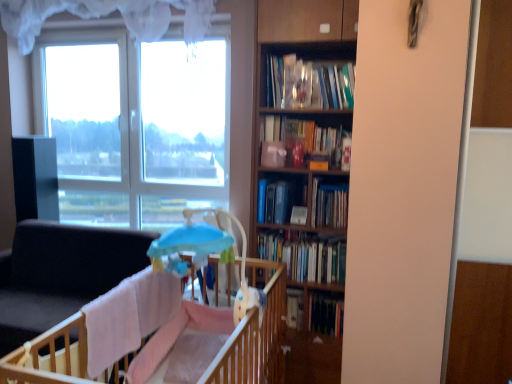
What is the approximate height of light blue fabric swivel chair at center?

light blue fabric swivel chair at center is 34.36 inches tall.

What do you see at coordinates (61, 274) in the screenshot? I see `light blue fabric swivel chair at center` at bounding box center [61, 274].

Where is `hardcover books at center, which is the third book in top-to-bottom order`? This screenshot has height=384, width=512. hardcover books at center, which is the third book in top-to-bottom order is located at coordinates (306, 257).

The image size is (512, 384). Find the location of `wooden bookcase at center`. wooden bookcase at center is located at coordinates (306, 165).

Find the location of a particular element. This screenshot has height=384, width=512. wooden crib at lower left is located at coordinates (228, 339).

Are transparent glass window at upper left and wooden bookcase at center far apart?

Yes, transparent glass window at upper left and wooden bookcase at center are quite far apart.

From the image's perspective, which is above, transparent glass window at upper left or wooden bookcase at center?

transparent glass window at upper left, from the image's perspective.

From a real-world perspective, relative to wooden bookcase at center, is transparent glass window at upper left vertically above or below?

transparent glass window at upper left is above wooden bookcase at center.

From the picture: Is transparent glass window at upper left taller than wooden bookcase at center?

In fact, transparent glass window at upper left may be shorter than wooden bookcase at center.

Locate an element on the screen. The height and width of the screenshot is (384, 512). swivel chair below the white sheer curtain at upper center (from a real-world perspective) is located at coordinates (61, 274).

Who is bigger, light blue fabric swivel chair at center or white sheer curtain at upper center?

Bigger between the two is light blue fabric swivel chair at center.

Would you consider light blue fabric swivel chair at center to be distant from white sheer curtain at upper center?

That's right, there is a large distance between light blue fabric swivel chair at center and white sheer curtain at upper center.

Is white sheer curtain at upper center located within light blue fabric swivel chair at center?

Definitely not — white sheer curtain at upper center is not inside light blue fabric swivel chair at center.

Is transparent glass window at upper left far away from blue hardcover book at center, which appears as the fourth book when ordered from the bottom?

Answer: transparent glass window at upper left is far away from blue hardcover book at center, which appears as the fourth book when ordered from the bottom.

Between transparent glass window at upper left and blue hardcover book at center, the 2th book viewed from the top, which one is positioned behind?

Positioned behind is transparent glass window at upper left.

What's the angular difference between transparent glass window at upper left and blue hardcover book at center, which appears as the fourth book when ordered from the bottom,'s facing directions?

They differ by 1.2 degrees in their facing directions.

Between transparent glass window at upper left and blue hardcover book at center, which appears as the fourth book when ordered from the bottom, which one has smaller width?

With smaller width is transparent glass window at upper left.

Which is further, (270, 201) or (199, 161)?

The point (199, 161) is farther.

In the scene shown: Is blue hardcover book at center, which appears as the fourth book when ordered from the bottom, not near transparent glass window at upper left?

Yes.

Identify the location of window on the left of blue hardcover book at center, the 2th book viewed from the top. Image resolution: width=512 pixels, height=384 pixels. (144, 117).

Looking at their sizes, would you say blue hardcover book at center, the 2th book viewed from the top, is wider or thinner than transparent glass window at upper left?

blue hardcover book at center, the 2th book viewed from the top, is wider than transparent glass window at upper left.

From the image's perspective, between hardcover book at center, which appears as the 2th book when ordered from the bottom, and light blue plastic baby carriage at center, who is located below?

hardcover book at center, which appears as the 2th book when ordered from the bottom, is shown below in the image.

Is hardcover book at center, which is counted as the 4th book, starting from the top, next to light blue plastic baby carriage at center?

There is a gap between hardcover book at center, which is counted as the 4th book, starting from the top, and light blue plastic baby carriage at center.

Considering the relative positions of hardcover book at center, which is counted as the 4th book, starting from the top, and light blue plastic baby carriage at center in the image provided, is hardcover book at center, which is counted as the 4th book, starting from the top, to the left of light blue plastic baby carriage at center from the viewer's perspective?

In fact, hardcover book at center, which is counted as the 4th book, starting from the top, is to the right of light blue plastic baby carriage at center.

Can you confirm if hardcover book at center, which appears as the 2th book when ordered from the bottom, is taller than light blue plastic baby carriage at center?

In fact, hardcover book at center, which appears as the 2th book when ordered from the bottom, may be shorter than light blue plastic baby carriage at center.

Does blue hardcover book at center, which appears as the fourth book when ordered from the bottom, lie in front of white sheer curtain at upper center?

That is True.

Can you confirm if blue hardcover book at center, which appears as the fourth book when ordered from the bottom, is taller than white sheer curtain at upper center?

Incorrect, the height of blue hardcover book at center, which appears as the fourth book when ordered from the bottom, is not larger of that of white sheer curtain at upper center.

Is blue hardcover book at center, the 2th book viewed from the top, spatially inside white sheer curtain at upper center, or outside of it?

blue hardcover book at center, the 2th book viewed from the top, is not enclosed by white sheer curtain at upper center.

Is blue hardcover book at center, the 2th book viewed from the top, looking in the opposite direction of white sheer curtain at upper center?

blue hardcover book at center, the 2th book viewed from the top, is not turned away from white sheer curtain at upper center.

From the image's perspective, which is below, hardcover books at center, marked as the third book in a bottom-to-top arrangement, or hardcover book at center, which appears as the 1th book when ordered from the bottom?

hardcover book at center, which appears as the 1th book when ordered from the bottom, is shown below in the image.

Could you tell me if hardcover books at center, which is the third book in top-to-bottom order, is facing hardcover book at center, the 5th book viewed from the top?

No, hardcover books at center, which is the third book in top-to-bottom order, does not turn towards hardcover book at center, the 5th book viewed from the top.

Based on the photo, between hardcover books at center, which is the third book in top-to-bottom order, and hardcover book at center, the 5th book viewed from the top, which one has larger width?

With larger width is hardcover books at center, which is the third book in top-to-bottom order.

Considering their positions, is hardcover books at center, which is the third book in top-to-bottom order, located in front of or behind hardcover book at center, the 5th book viewed from the top?

In the image, hardcover books at center, which is the third book in top-to-bottom order, appears in front of hardcover book at center, the 5th book viewed from the top.

The image size is (512, 384). In order to click on bookcase below the transparent glass window at upper left (from a real-world perspective) in this screenshot , I will do point(306,165).

There is a light blue fabric swivel chair at center. Where is `curtain above it (from a real-world perspective)`? The width and height of the screenshot is (512, 384). curtain above it (from a real-world perspective) is located at coordinates (106, 14).

From the image, which object appears to be farther from white sheer curtain at upper center, wooden bookcase at center or light blue plastic baby carriage at center?

light blue plastic baby carriage at center.

From the image, which object appears to be farther from hardcover books at center, marked as the third book in a bottom-to-top arrangement, wooden crib at lower left or light blue fabric swivel chair at center?

light blue fabric swivel chair at center lies further to hardcover books at center, marked as the third book in a bottom-to-top arrangement, than the other object.

Considering their positions, is light blue fabric swivel chair at center positioned closer to hardcover book at center, which is counted as the 4th book, starting from the top, than matte orange bookshelf at center, the fifth book positioned from the bottom?

matte orange bookshelf at center, the fifth book positioned from the bottom, is positioned closer to the anchor hardcover book at center, which is counted as the 4th book, starting from the top.

From the image, which object appears to be nearer to wooden bookcase at center, light blue plastic baby carriage at center or hardcover books at center, marked as the third book in a bottom-to-top arrangement?

hardcover books at center, marked as the third book in a bottom-to-top arrangement, lies closer to wooden bookcase at center than the other object.

Considering their positions, is hardcover book at center, which appears as the 1th book when ordered from the bottom, positioned further to light blue fabric swivel chair at center than light blue plastic baby carriage at center?

hardcover book at center, which appears as the 1th book when ordered from the bottom, is further to light blue fabric swivel chair at center.

When comparing their distances from light blue plastic baby carriage at center, does light blue fabric swivel chair at center or transparent glass window at upper left seem further?

transparent glass window at upper left is positioned further to the anchor light blue plastic baby carriage at center.

Looking at the image, which one is located closer to wooden crib at lower left, hardcover books at center, marked as the third book in a bottom-to-top arrangement, or light blue fabric swivel chair at center?

hardcover books at center, marked as the third book in a bottom-to-top arrangement, lies closer to wooden crib at lower left than the other object.

Based on their spatial positions, is hardcover books at center, marked as the third book in a bottom-to-top arrangement, or light blue fabric swivel chair at center further from matte orange bookshelf at center, which is the 1th book in top-to-bottom order?

Based on the image, light blue fabric swivel chair at center appears to be further to matte orange bookshelf at center, which is the 1th book in top-to-bottom order.

The width and height of the screenshot is (512, 384). I want to click on baby carriage between light blue fabric swivel chair at center and wooden bookcase at center, so click(x=210, y=253).

At what (x,y) coordinates should I click in order to perform the action: click on baby carriage that lies between white sheer curtain at upper center and hardcover book at center, which is counted as the 4th book, starting from the top, from top to bottom. Please return your answer as a coordinate pair (x, y). Looking at the image, I should click on (210, 253).

Find the location of a particular element. baby carriage between white sheer curtain at upper center and light blue fabric swivel chair at center in the vertical direction is located at coordinates (210, 253).

Find the location of `book between light blue fabric swivel chair at center and hardcover book at center, which appears as the 2th book when ordered from the bottom, in the horizontal direction`. book between light blue fabric swivel chair at center and hardcover book at center, which appears as the 2th book when ordered from the bottom, in the horizontal direction is located at coordinates (279, 200).